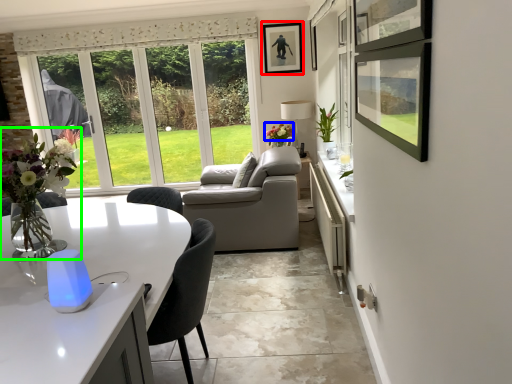
Question: Which object is the farthest from picture frame (highlighted by a red box)? Choose among these: flower (highlighted by a blue box) or floral arrangement (highlighted by a green box).

Choices:
 (A) flower
 (B) floral arrangement

Answer: (B)